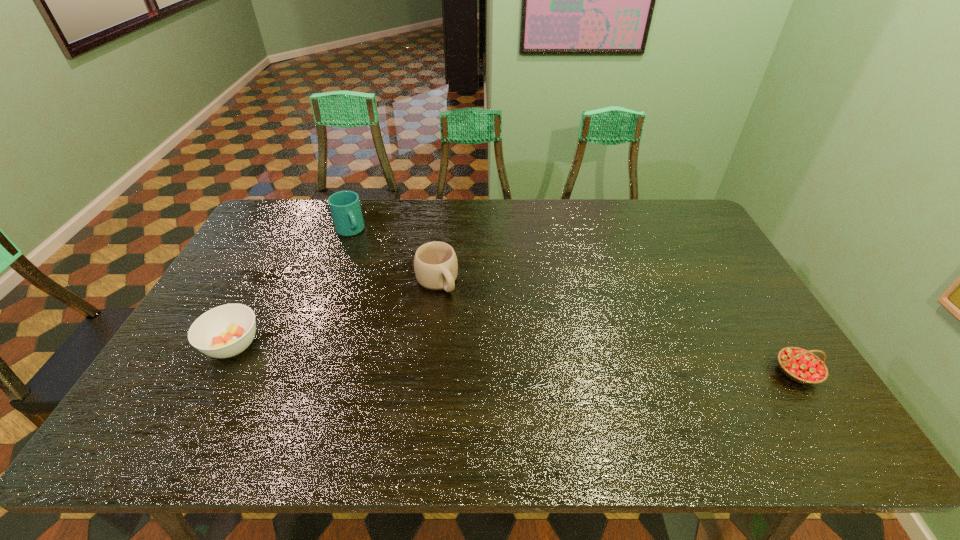
The image size is (960, 540). Identify the location of free space on the desktop that is between the soup bowl and the strawberry and is positioned on the handle side of the tallest object. (435, 355).

I want to click on free space on the desktop that is between the leftmost object and the strawberry and is positioned on the side of the mug with the handle, so click(x=496, y=357).